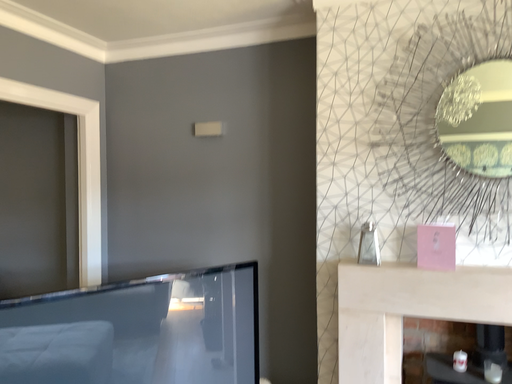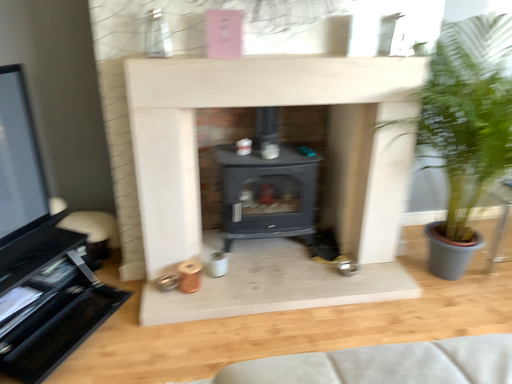
Question: How did the camera likely rotate when shooting the video?

Choices:
 (A) rotated downward
 (B) rotated upward

Answer: (A)